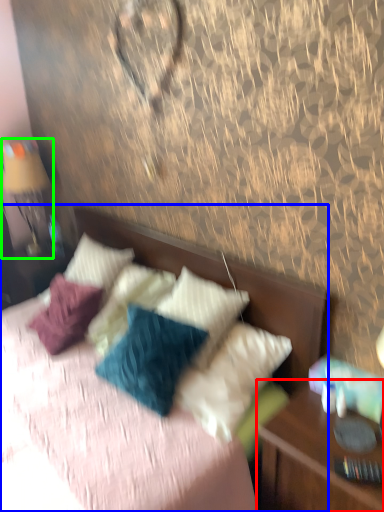
Question: Considering the real-world distances, which object is closest to nightstand (highlighted by a red box)? bed (highlighted by a blue box) or bedside lamp (highlighted by a green box).

Choices:
 (A) bed
 (B) bedside lamp

Answer: (A)